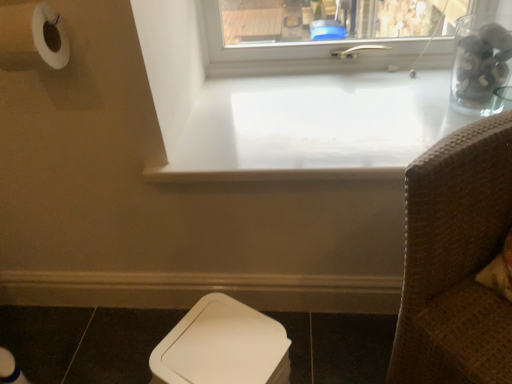
Find the location of `vacant space behind transparent glass jar at upper right`. vacant space behind transparent glass jar at upper right is located at coordinates (420, 83).